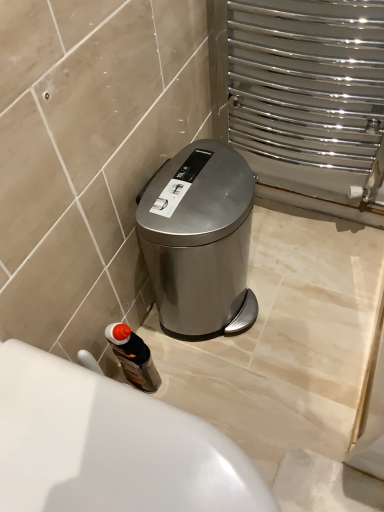
Question: Is wooden textured bottle at lower left to the left of satin silver trash can at center from the viewer's perspective?

Choices:
 (A) yes
 (B) no

Answer: (A)

Question: Is wooden textured bottle at lower left completely or partially outside of satin silver trash can at center?

Choices:
 (A) yes
 (B) no

Answer: (A)

Question: Would you say satin silver trash can at center is part of wooden textured bottle at lower left's contents?

Choices:
 (A) no
 (B) yes

Answer: (A)

Question: Does wooden textured bottle at lower left have a lesser height compared to satin silver trash can at center?

Choices:
 (A) no
 (B) yes

Answer: (B)

Question: Is wooden textured bottle at lower left aimed at satin silver trash can at center?

Choices:
 (A) yes
 (B) no

Answer: (B)

Question: From the image's perspective, relative to wooden textured bottle at lower left, is white glossy bath at lower left above or below?

Choices:
 (A) above
 (B) below

Answer: (B)

Question: In the image, is white glossy bath at lower left positioned in front of or behind wooden textured bottle at lower left?

Choices:
 (A) behind
 (B) front

Answer: (B)

Question: Based on their sizes in the image, would you say white glossy bath at lower left is bigger or smaller than wooden textured bottle at lower left?

Choices:
 (A) big
 (B) small

Answer: (A)

Question: Is point (117, 449) positioned closer to the camera than point (142, 345)?

Choices:
 (A) closer
 (B) farther

Answer: (A)

Question: From the image's perspective, is wooden textured bottle at lower left above or below white glossy bath at lower left?

Choices:
 (A) below
 (B) above

Answer: (B)

Question: Relative to white glossy bath at lower left, is wooden textured bottle at lower left in front or behind?

Choices:
 (A) front
 (B) behind

Answer: (B)

Question: In the image, is wooden textured bottle at lower left on the left side or the right side of white glossy bath at lower left?

Choices:
 (A) right
 (B) left

Answer: (B)

Question: Looking at the image, does wooden textured bottle at lower left seem bigger or smaller compared to white glossy bath at lower left?

Choices:
 (A) big
 (B) small

Answer: (B)

Question: Considering their positions, is satin silver trash can at center located in front of or behind wooden textured bottle at lower left?

Choices:
 (A) behind
 (B) front

Answer: (B)

Question: Considering the positions of satin silver trash can at center and wooden textured bottle at lower left in the image, is satin silver trash can at center bigger or smaller than wooden textured bottle at lower left?

Choices:
 (A) big
 (B) small

Answer: (A)